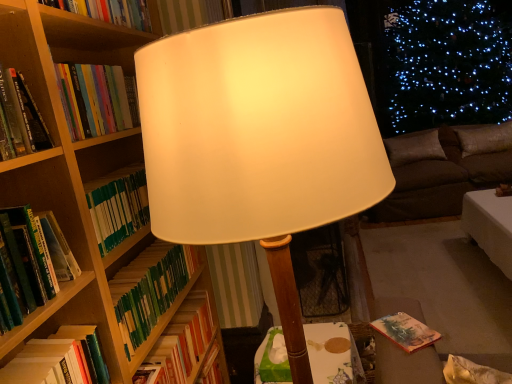
Question: Is wooden table at center looking in the opposite direction of brown fabric pillow at right, the first pillow positioned from the right?

Choices:
 (A) yes
 (B) no

Answer: (B)

Question: Are wooden table at center and brown fabric pillow at right, the first pillow positioned from the right, beside each other?

Choices:
 (A) yes
 (B) no

Answer: (B)

Question: From the image's perspective, is wooden table at center below brown fabric pillow at right, the first pillow positioned from the right?

Choices:
 (A) no
 (B) yes

Answer: (B)

Question: Does wooden table at center have a larger size compared to brown fabric pillow at right, the first pillow positioned from the right?

Choices:
 (A) yes
 (B) no

Answer: (A)

Question: Is brown fabric pillow at right, the first pillow positioned from the right, inside wooden table at center?

Choices:
 (A) no
 (B) yes

Answer: (A)

Question: From the image's perspective, is wooden table at center over brown fabric pillow at right, the first pillow positioned from the right?

Choices:
 (A) yes
 (B) no

Answer: (B)

Question: Can green hardcover book at left, which is the 2th book from top to bottom, be found inside dark brown fabric couch at right?

Choices:
 (A) no
 (B) yes

Answer: (A)

Question: Is dark brown fabric couch at right not close to green hardcover book at left, which is the 3th book in bottom-to-top order?

Choices:
 (A) yes
 (B) no

Answer: (A)

Question: From the image's perspective, is dark brown fabric couch at right located above green hardcover book at left, which is the 2th book from top to bottom?

Choices:
 (A) no
 (B) yes

Answer: (B)

Question: Can you confirm if dark brown fabric couch at right is shorter than green hardcover book at left, which is the 2th book from top to bottom?

Choices:
 (A) no
 (B) yes

Answer: (A)

Question: Is dark brown fabric couch at right behind green hardcover book at left, which is the 2th book from top to bottom?

Choices:
 (A) no
 (B) yes

Answer: (B)

Question: Does dark brown fabric couch at right have a greater height compared to green hardcover book at left, which is the 2th book from top to bottom?

Choices:
 (A) yes
 (B) no

Answer: (A)

Question: Are brown suede pillow at right, arranged as the 2th pillow when viewed from the right, and green matte book at left, the fourth book when ordered from top to bottom, far apart?

Choices:
 (A) yes
 (B) no

Answer: (A)